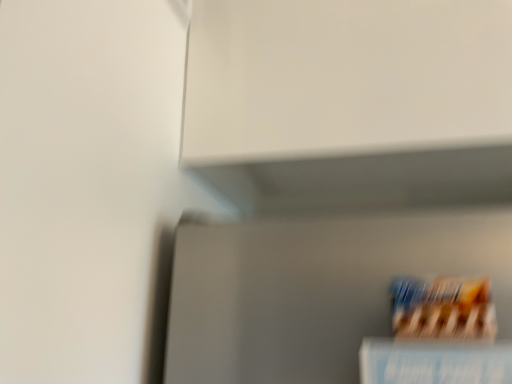
Question: Should I look upward or downward to see blue paper book at lower right?

Choices:
 (A) up
 (B) down

Answer: (B)

Question: Is blue paper book at lower right turned away from blue cardboard cereal at lower right?

Choices:
 (A) yes
 (B) no

Answer: (B)

Question: Considering the relative sizes of blue paper book at lower right and blue cardboard cereal at lower right in the image provided, is blue paper book at lower right smaller than blue cardboard cereal at lower right?

Choices:
 (A) yes
 (B) no

Answer: (B)

Question: Is blue cardboard cereal at lower right completely or partially inside blue paper book at lower right?

Choices:
 (A) yes
 (B) no

Answer: (B)

Question: Is blue paper book at lower right to the right of blue cardboard cereal at lower right from the viewer's perspective?

Choices:
 (A) yes
 (B) no

Answer: (B)

Question: Is blue paper book at lower right next to blue cardboard cereal at lower right?

Choices:
 (A) no
 (B) yes

Answer: (B)

Question: From a real-world perspective, is blue paper book at lower right located beneath blue cardboard cereal at lower right?

Choices:
 (A) no
 (B) yes

Answer: (B)

Question: Does blue cardboard cereal at lower right have a lesser height compared to blue paper book at lower right?

Choices:
 (A) yes
 (B) no

Answer: (A)

Question: Could you tell me if blue cardboard cereal at lower right is turned towards blue paper book at lower right?

Choices:
 (A) no
 (B) yes

Answer: (A)

Question: Considering the relative sizes of blue cardboard cereal at lower right and blue paper book at lower right in the image provided, is blue cardboard cereal at lower right taller than blue paper book at lower right?

Choices:
 (A) yes
 (B) no

Answer: (B)

Question: Is blue cardboard cereal at lower right far away from blue paper book at lower right?

Choices:
 (A) no
 (B) yes

Answer: (A)

Question: Is blue cardboard cereal at lower right wider than blue paper book at lower right?

Choices:
 (A) yes
 (B) no

Answer: (B)

Question: Can you confirm if blue cardboard cereal at lower right is bigger than blue paper book at lower right?

Choices:
 (A) no
 (B) yes

Answer: (A)

Question: From a real-world perspective, is blue paper book at lower right physically located above or below blue cardboard cereal at lower right?

Choices:
 (A) below
 (B) above

Answer: (A)